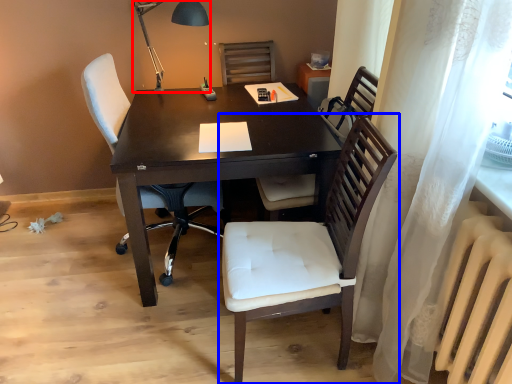
Question: Which point is closer to the camera, table lamp (highlighted by a red box) or chair (highlighted by a blue box)?

Choices:
 (A) table lamp
 (B) chair

Answer: (B)